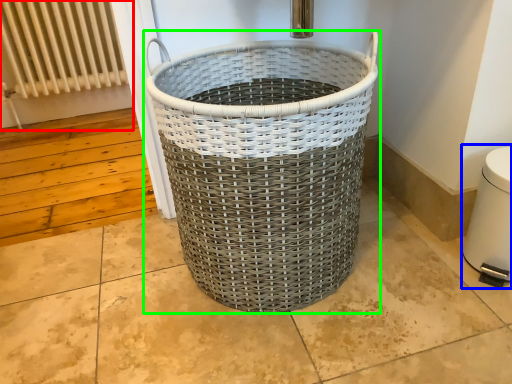
Question: Which object is positioned farthest from radiator (highlighted by a red box)? Select from water heater (highlighted by a blue box) and waste container (highlighted by a green box).

Choices:
 (A) water heater
 (B) waste container

Answer: (A)